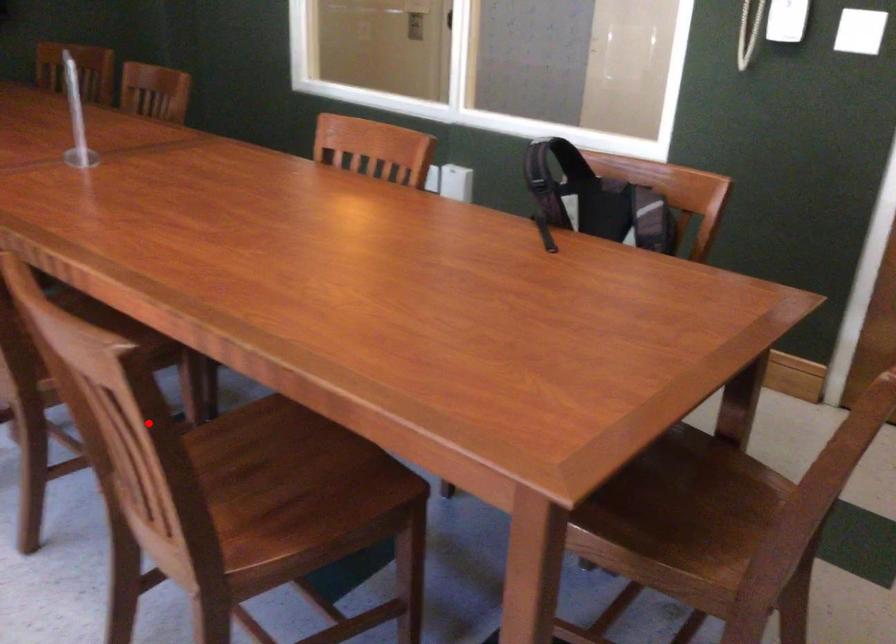
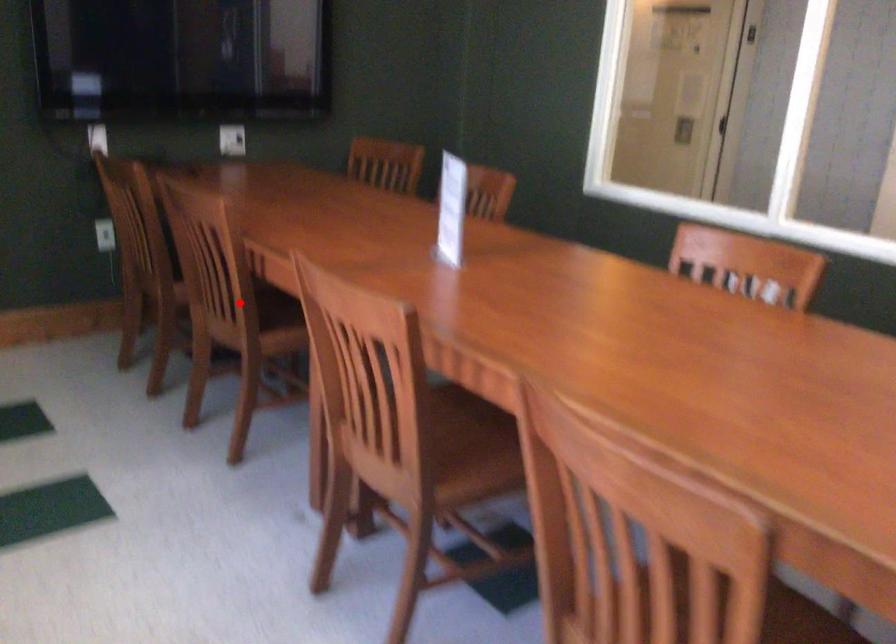
I am providing you with two images of the same scene from different viewpoints. A red point is marked on the first image and another point is marked on the second image. Does the point marked in image1 correspond to the same location as the one in image2?

No